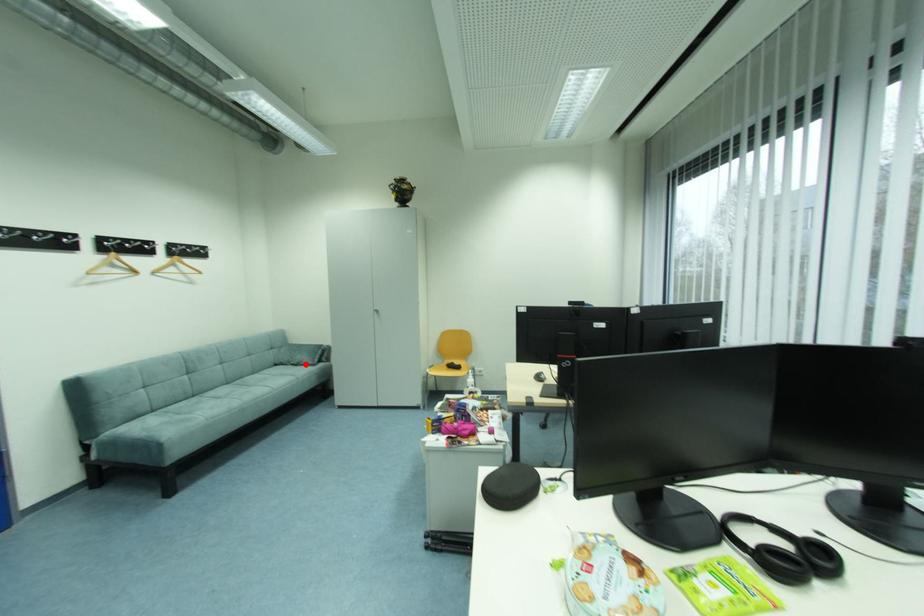
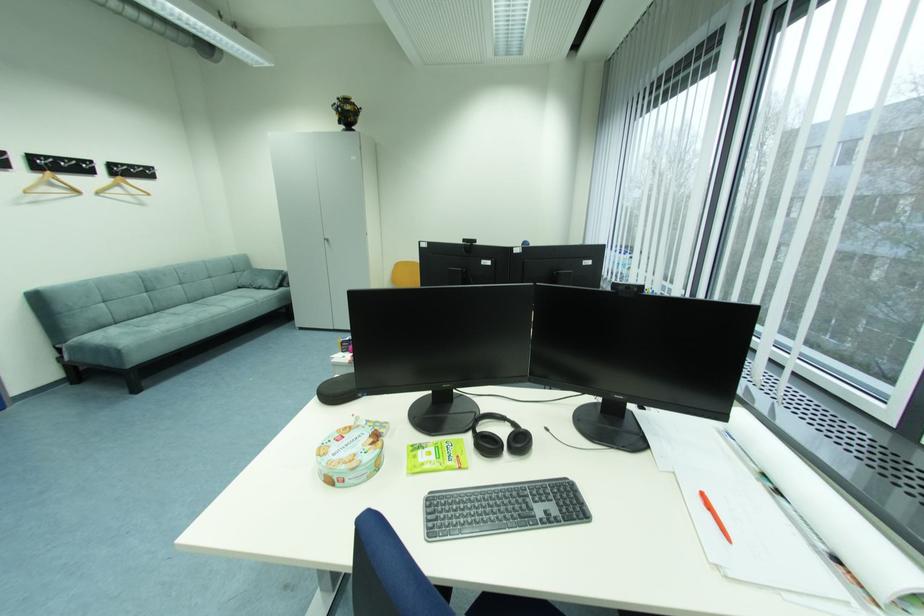
Find the pixel in the second image that matches the highlighted location in the first image.

(266, 286)